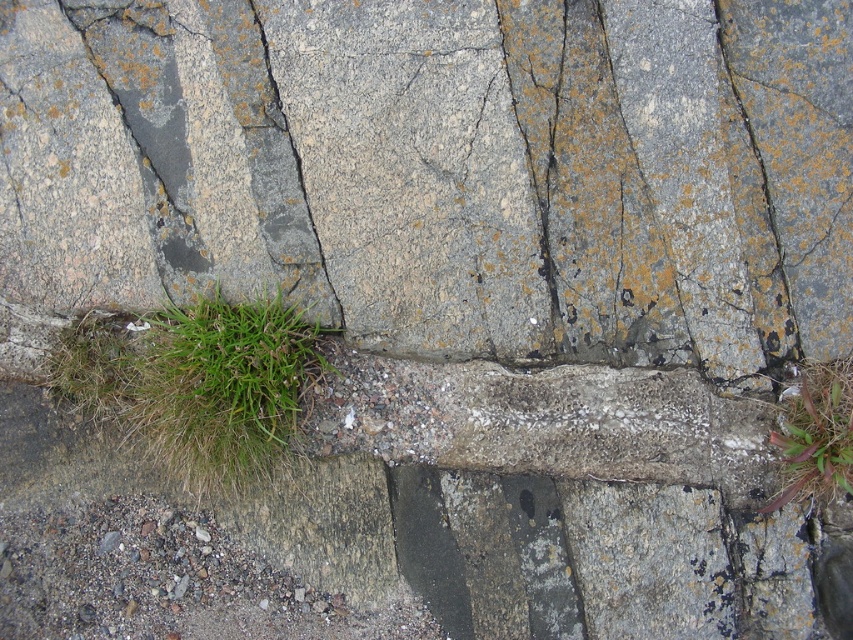
Question: Can you confirm if green grass at lower left is wider than green grass at lower right?

Choices:
 (A) yes
 (B) no

Answer: (A)

Question: Which is farther from the green grass at lower left?

Choices:
 (A) green grass at lower right
 (B) gray rough stone at center

Answer: (A)

Question: Is green grass at lower left smaller than green grass at lower right?

Choices:
 (A) yes
 (B) no

Answer: (B)

Question: Does green grass at lower left have a greater width compared to green grass at lower right?

Choices:
 (A) yes
 (B) no

Answer: (A)

Question: Which of these objects is positioned closest to the green grass at lower right?

Choices:
 (A) green grass at lower left
 (B) gray rough stone at center

Answer: (B)

Question: Which of the following is the closest to the observer?

Choices:
 (A) green grass at lower left
 (B) green grass at lower right

Answer: (B)